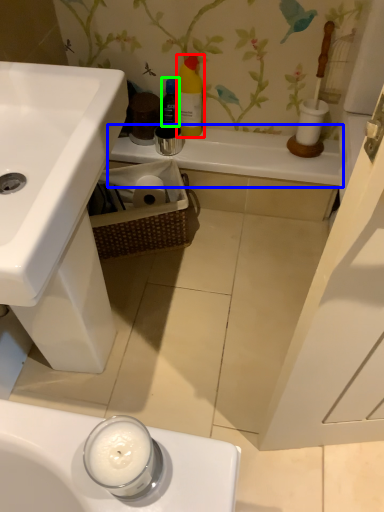
Question: Estimate the real-world distances between objects in this image. Which object is farther from cleaning product (highlighted by a red box), counter top (highlighted by a blue box) or bottle (highlighted by a green box)?

Choices:
 (A) counter top
 (B) bottle

Answer: (A)